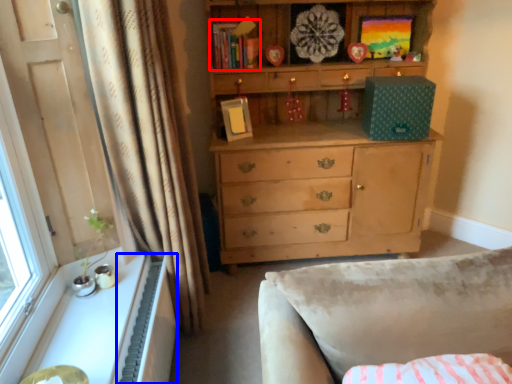
Question: Which object appears closest to the camera in this image, book (highlighted by a red box) or radiator (highlighted by a blue box)?

Choices:
 (A) book
 (B) radiator

Answer: (B)